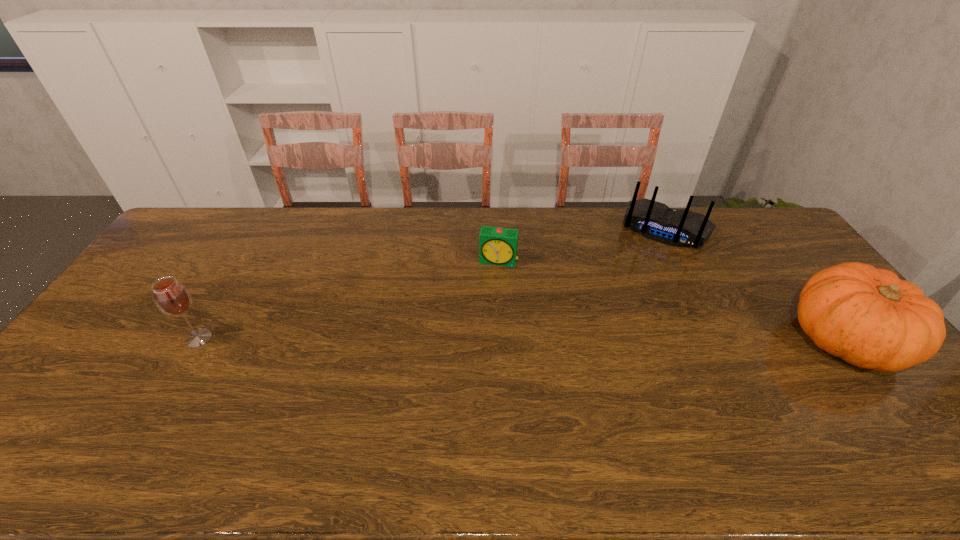
Locate an element on the screen. This screenshot has height=540, width=960. the second closest object to the third object from right to left is located at coordinates (868, 317).

At what (x,y) coordinates should I click in order to perform the action: click on vacant space that satisfies the following two spatial constraints: 1. on the back side of the leftmost object; 2. on the left side of the shortest object. Please return your answer as a coordinate pair (x, y). Image resolution: width=960 pixels, height=540 pixels. Looking at the image, I should click on (245, 261).